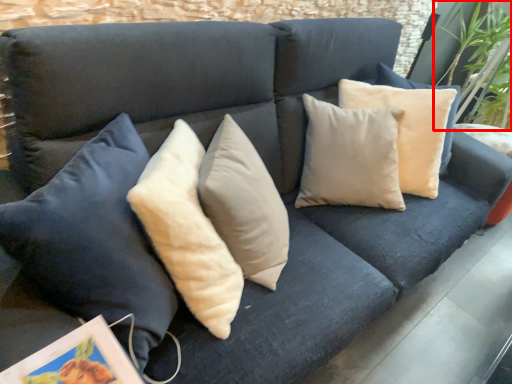
Question: In this image, where is plant (annotated by the red box) located relative to picture frame?

Choices:
 (A) right
 (B) left

Answer: (A)